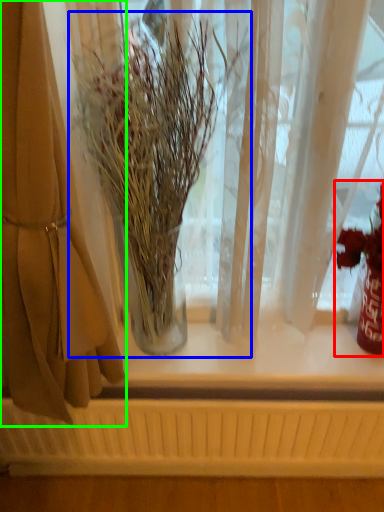
Question: Which object is the farthest from floral arrangement (highlighted by a red box)? Choose among these: houseplant (highlighted by a blue box) or curtain (highlighted by a green box).

Choices:
 (A) houseplant
 (B) curtain

Answer: (B)